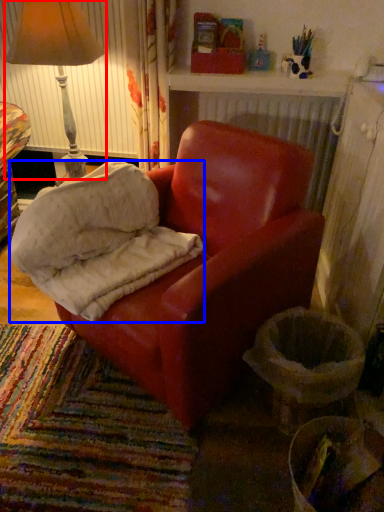
Question: Which object appears closest to the camera in this image, lamp (highlighted by a red box) or material (highlighted by a blue box)?

Choices:
 (A) lamp
 (B) material

Answer: (B)